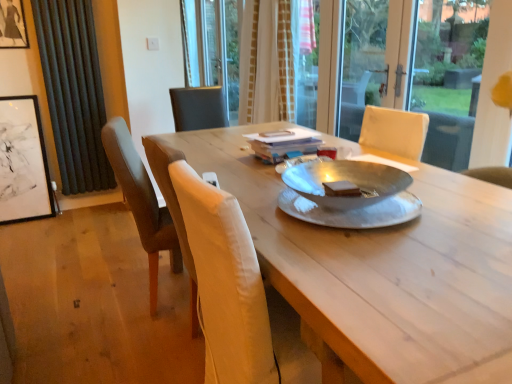
Question: From the image's perspective, is brown leather chair at left located above or below wooden table at center?

Choices:
 (A) above
 (B) below

Answer: (A)

Question: Considering the positions of brown leather chair at left and wooden table at center in the image, is brown leather chair at left bigger or smaller than wooden table at center?

Choices:
 (A) small
 (B) big

Answer: (A)

Question: Estimate the real-world distances between objects in this image. Which object is farther from the black matte picture frame at left, positioned as the first picture frame in bottom-to-top order?

Choices:
 (A) brown leather chair at left
 (B) white textured curtain at center, which is counted as the first curtain, starting from the right
 (C) matte black picture frame at upper left, arranged as the 1th picture frame when viewed from the top
 (D) transparent glass screen door at upper center
 (E) dark grey fabric curtain at left, positioned as the second curtain in right-to-left order

Answer: (D)

Question: Which is farther from the dark grey fabric curtain at left, positioned as the second curtain in right-to-left order?

Choices:
 (A) white textured curtain at center, which is the second curtain from left to right
 (B) wooden table at center
 (C) black matte picture frame at left, the 2th picture frame from the top
 (D) transparent glass screen door at upper center
 (E) matte black picture frame at upper left, arranged as the 1th picture frame when viewed from the top

Answer: (D)